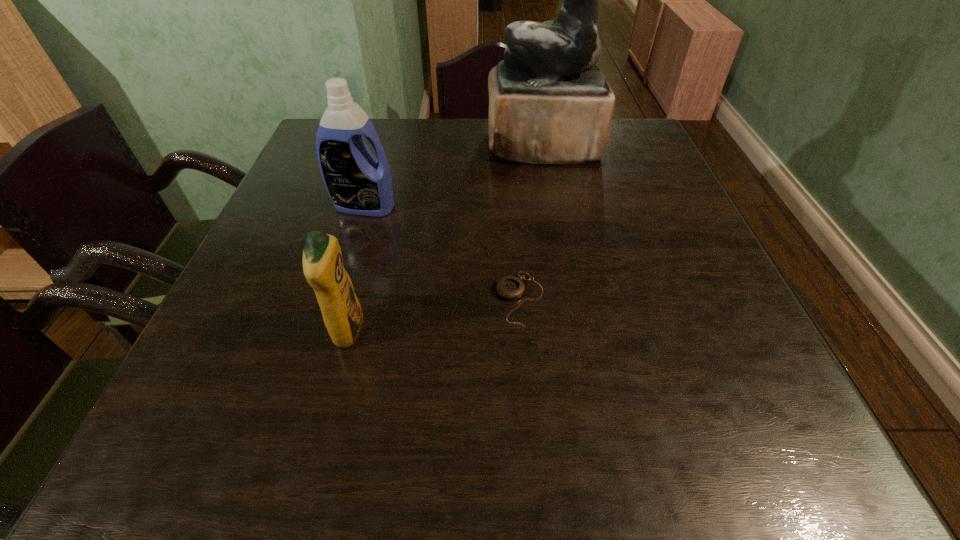
This screenshot has height=540, width=960. Identify the location of vacant region located on the left of the farther detergent. (299, 207).

This screenshot has height=540, width=960. Find the location of `free space located on the label of the second shortest object`. free space located on the label of the second shortest object is located at coordinates (493, 332).

Find the location of a particular element. Image resolution: width=960 pixels, height=540 pixels. free point located on the right of the pocket watch is located at coordinates (651, 299).

Locate an element on the screen. This screenshot has height=540, width=960. object present at the far edge is located at coordinates (549, 103).

Find the location of a particular element. The width and height of the screenshot is (960, 540). object that is at the left edge is located at coordinates (358, 183).

The image size is (960, 540). In order to click on object present at the right edge in this screenshot , I will do `click(549, 103)`.

Find the location of `object present at the far right corner`. object present at the far right corner is located at coordinates (549, 103).

At what (x,y) coordinates should I click in order to perform the action: click on free spot at the far edge of the desktop. Please return your answer as a coordinate pair (x, y). The height and width of the screenshot is (540, 960). Looking at the image, I should click on (477, 124).

This screenshot has height=540, width=960. In the image, there is a desktop. Identify the location of vacant area at the near edge. (284, 439).

The height and width of the screenshot is (540, 960). Identify the location of vacant space at the left edge of the desktop. (298, 279).